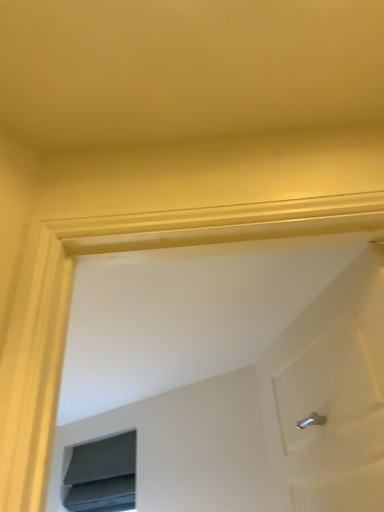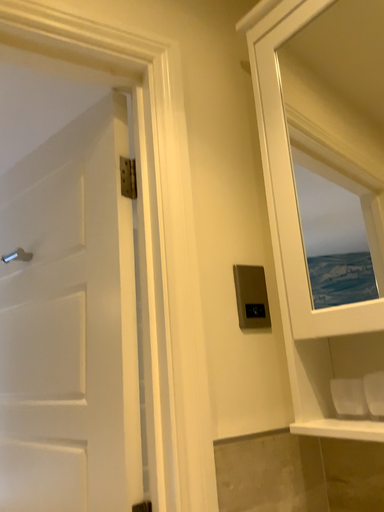
Question: How did the camera likely rotate when shooting the video?

Choices:
 (A) rotated upward
 (B) rotated downward

Answer: (B)